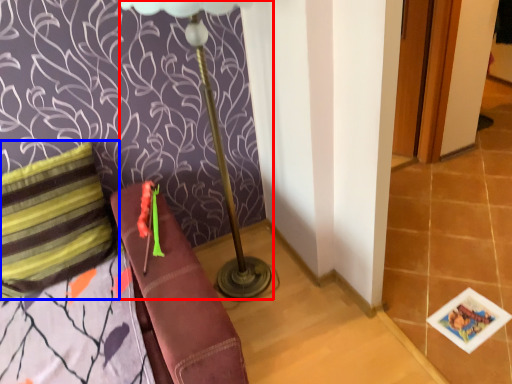
Question: Among these objects, which one is nearest to the camera, table lamp (highlighted by a red box) or pillow (highlighted by a blue box)?

Choices:
 (A) table lamp
 (B) pillow

Answer: (A)